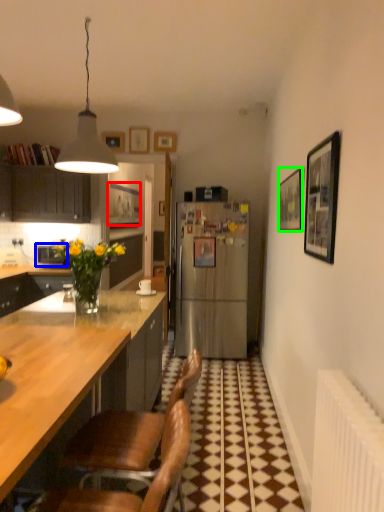
Question: Which is farther away from picture frame (highlighted by a red box)? appliance (highlighted by a blue box) or picture frame (highlighted by a green box)?

Choices:
 (A) appliance
 (B) picture frame

Answer: (B)